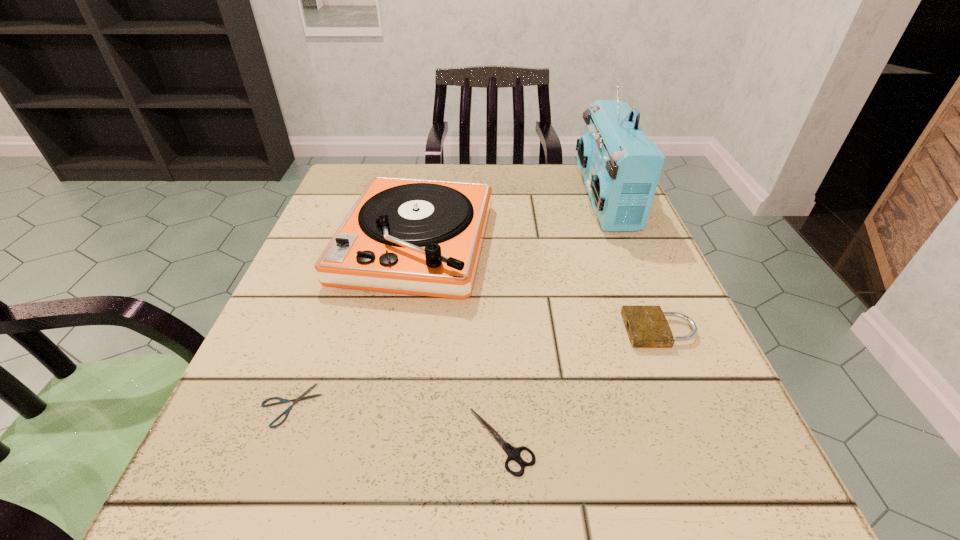
Locate an element on the screen. record player present at the left edge is located at coordinates (421, 237).

You are a GUI agent. You are given a task and a screenshot of the screen. Output one action in this format:
    pyautogui.click(x=<x>, y=<y>)
    Task: Click on the shears located in the left edge section of the desktop
    
    Given the screenshot: What is the action you would take?
    pyautogui.click(x=300, y=398)

Where is `radio receiver that is at the right edge`? This screenshot has height=540, width=960. radio receiver that is at the right edge is located at coordinates [621, 167].

Locate an element on the screen. padlock located at the right edge is located at coordinates (647, 327).

Image resolution: width=960 pixels, height=540 pixels. Identify the location of object located in the far left corner section of the desktop. (421, 237).

In order to click on object positioned at the far right corner in this screenshot , I will do `click(621, 167)`.

Image resolution: width=960 pixels, height=540 pixels. I want to click on vacant area at the far edge, so click(525, 165).

The image size is (960, 540). In the image, there is a desktop. Find the location of `free space at the near edge`. free space at the near edge is located at coordinates (612, 474).

I want to click on vacant space at the left edge, so click(x=276, y=413).

The height and width of the screenshot is (540, 960). I want to click on free space at the right edge, so click(x=574, y=246).